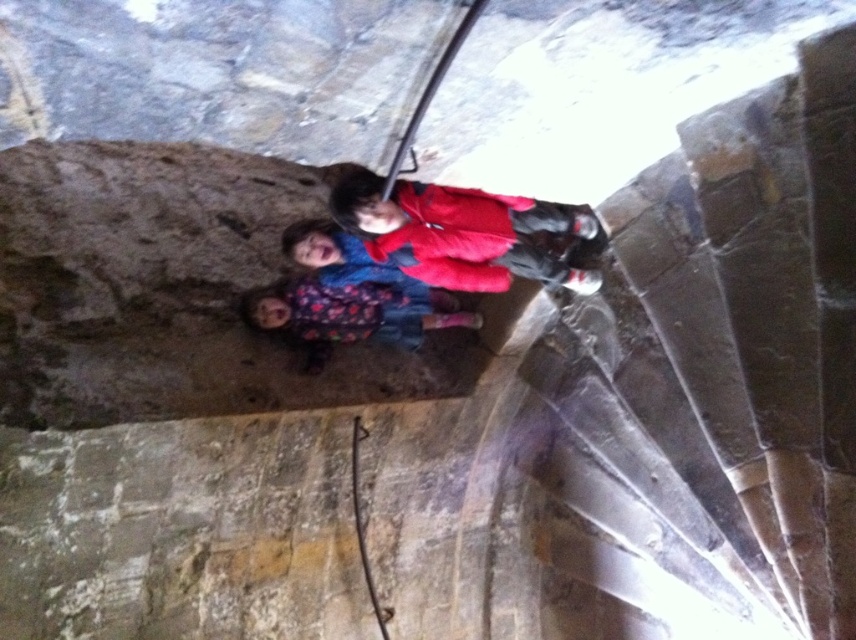
Between matte red jacket at center and floral-patterned fabric at center, which one appears on the right side from the viewer's perspective?

From the viewer's perspective, matte red jacket at center appears more on the right side.

Can you confirm if matte red jacket at center is positioned to the left of floral-patterned fabric at center?

No, matte red jacket at center is not to the left of floral-patterned fabric at center.

Is point (559, 228) farther from camera compared to point (337, 304)?

No.

At what (x,y) coordinates should I click in order to perform the action: click on matte red jacket at center. Please return your answer as a coordinate pair (x, y). Looking at the image, I should click on (461, 232).